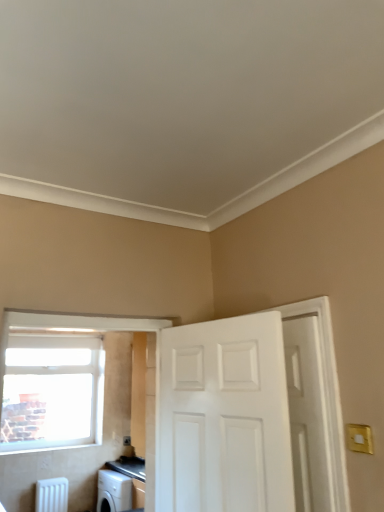
Question: Is point [205, 373] positioned closer to the camera than point [51, 497]?

Choices:
 (A) farther
 (B) closer

Answer: (B)

Question: Relative to white plastic radiator at lower left, is white glossy door at center, the second door in the right-to-left sequence, in front or behind?

Choices:
 (A) front
 (B) behind

Answer: (A)

Question: Considering the real-world distances, which object is farthest from the white glossy door at center, marked as the 1th door in a left-to-right arrangement?

Choices:
 (A) clear glass window at upper left
 (B) white matte door at right, placed as the second door when sorted from left to right
 (C) white plastic radiator at lower left

Answer: (C)

Question: Which object is the closest to the white glossy door at center, marked as the 1th door in a left-to-right arrangement?

Choices:
 (A) white matte door at right, placed as the second door when sorted from left to right
 (B) white plastic radiator at lower left
 (C) clear glass window at upper left

Answer: (A)